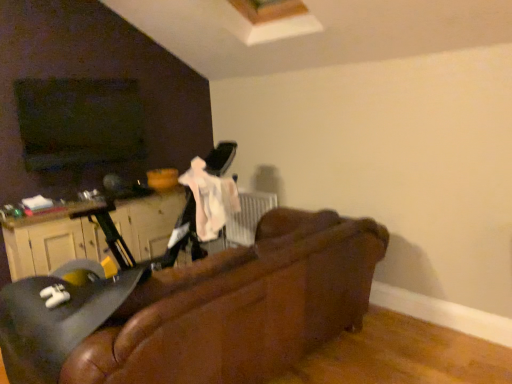
Question: Does matte black swivel chair at left have a greater height compared to wooden dresser at left?

Choices:
 (A) yes
 (B) no

Answer: (A)

Question: Is matte black swivel chair at left not inside wooden dresser at left?

Choices:
 (A) no
 (B) yes

Answer: (B)

Question: Would you say matte black swivel chair at left is a long distance from wooden dresser at left?

Choices:
 (A) no
 (B) yes

Answer: (B)

Question: Could wooden dresser at left be considered to be inside matte black swivel chair at left?

Choices:
 (A) yes
 (B) no

Answer: (B)

Question: Is matte black swivel chair at left wider than wooden dresser at left?

Choices:
 (A) no
 (B) yes

Answer: (B)

Question: Is matte black swivel chair at left in front of wooden dresser at left?

Choices:
 (A) yes
 (B) no

Answer: (A)

Question: Does wooden dresser at left have a larger size compared to leather couch at center?

Choices:
 (A) yes
 (B) no

Answer: (B)

Question: Is wooden dresser at left further to the viewer compared to leather couch at center?

Choices:
 (A) yes
 (B) no

Answer: (A)

Question: From a real-world perspective, is wooden dresser at left below leather couch at center?

Choices:
 (A) yes
 (B) no

Answer: (B)

Question: Can you confirm if wooden dresser at left is smaller than leather couch at center?

Choices:
 (A) no
 (B) yes

Answer: (B)

Question: Does wooden dresser at left touch leather couch at center?

Choices:
 (A) yes
 (B) no

Answer: (B)

Question: Is wooden dresser at left to the right of leather couch at center from the viewer's perspective?

Choices:
 (A) yes
 (B) no

Answer: (B)

Question: From the image's perspective, is leather couch at center on top of matte black swivel chair at left?

Choices:
 (A) yes
 (B) no

Answer: (A)